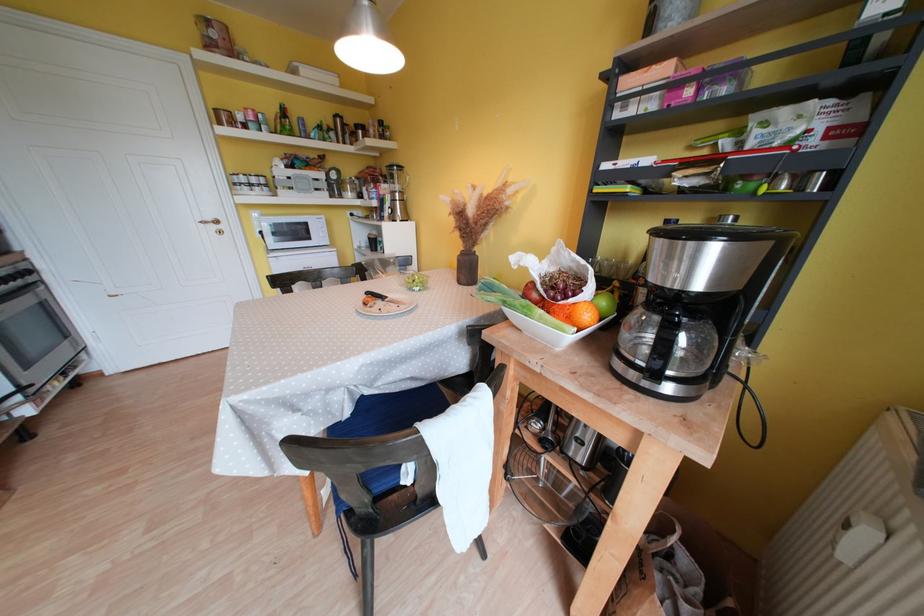
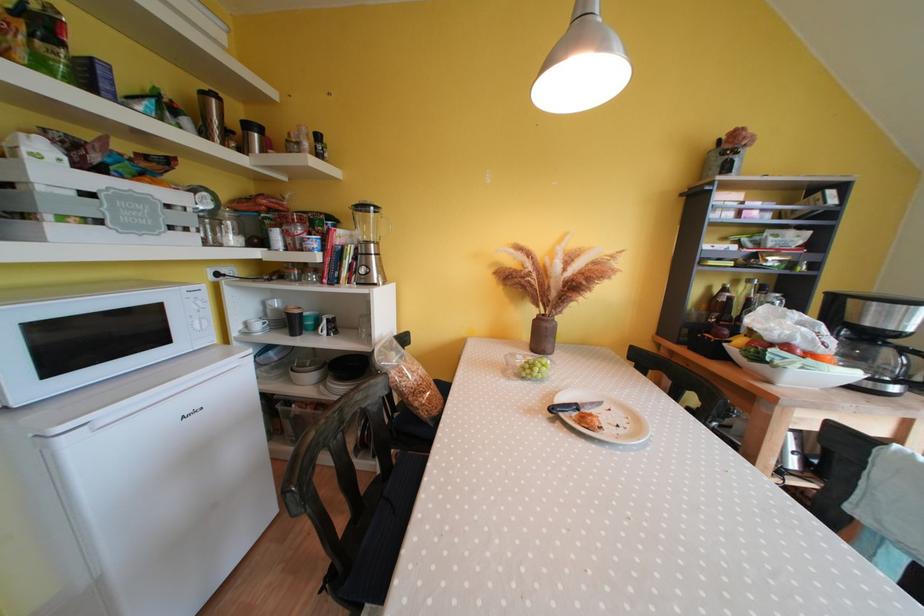
Find the pixel in the second image that matches point 331,188 in the first image.

(196, 224)